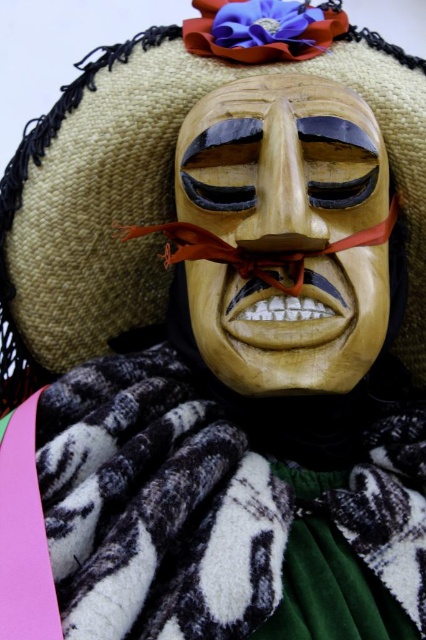
Question: Among these objects, which one is farthest from the camera?

Choices:
 (A) red silk ribbon at center
 (B) wooden mask at center

Answer: (A)

Question: Is wooden mask at center closer to the viewer compared to red silk ribbon at center?

Choices:
 (A) yes
 (B) no

Answer: (A)

Question: Among these points, which one is farthest from the camera?

Choices:
 (A) (363, 243)
 (B) (210, 147)

Answer: (A)

Question: Can you confirm if wooden mask at center is bigger than red silk ribbon at center?

Choices:
 (A) yes
 (B) no

Answer: (A)

Question: Which of the following is the closest to the observer?

Choices:
 (A) (129, 237)
 (B) (247, 168)

Answer: (A)

Question: Can you confirm if wooden mask at center is bigger than red silk ribbon at center?

Choices:
 (A) yes
 (B) no

Answer: (A)